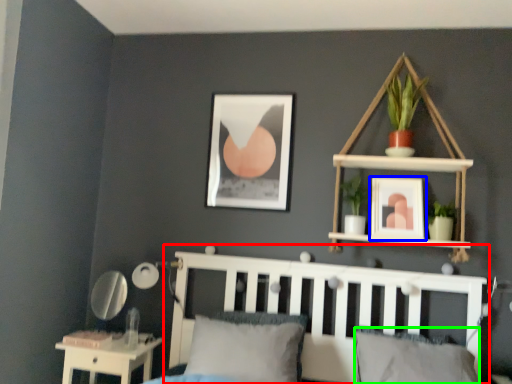
Question: Estimate the real-world distances between objects in this image. Which object is closer to bed frame (highlighted by a red box), picture frame (highlighted by a blue box) or pillow (highlighted by a green box)?

Choices:
 (A) picture frame
 (B) pillow

Answer: (B)